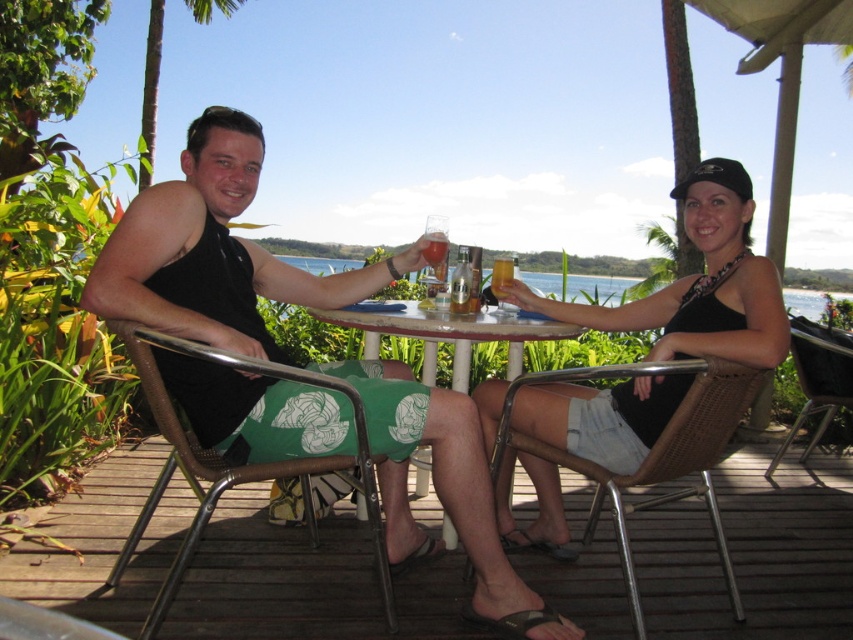
Does matte black tank top at center have a greater height compared to white plastic table at center?

Yes, matte black tank top at center is taller than white plastic table at center.

Is point (373, 442) positioned behind point (465, 333)?

No, it is in front of (465, 333).

Is point (469, 426) positioned in front of point (508, 324)?

Yes, it is.

Where is `matte black tank top at center`? The height and width of the screenshot is (640, 853). matte black tank top at center is located at coordinates (213, 252).

Between point (724, 324) and point (572, 285), which one is positioned in front?

Point (724, 324) is in front.

Does black fabric dress at center have a lesser height compared to clear water at table center?

No, black fabric dress at center is not shorter than clear water at table center.

This screenshot has height=640, width=853. I want to click on black fabric dress at center, so click(699, 282).

Who is positioned more to the right, translucent glass at table center or translucent glass at center?

translucent glass at table center is more to the right.

Between translucent glass at table center and translucent glass at center, which one has more height?

With more height is translucent glass at table center.

Is point (502, 278) more distant than point (440, 253)?

Yes, it is behind point (440, 253).

Where is `translucent glass at table center`? This screenshot has height=640, width=853. translucent glass at table center is located at coordinates (502, 275).